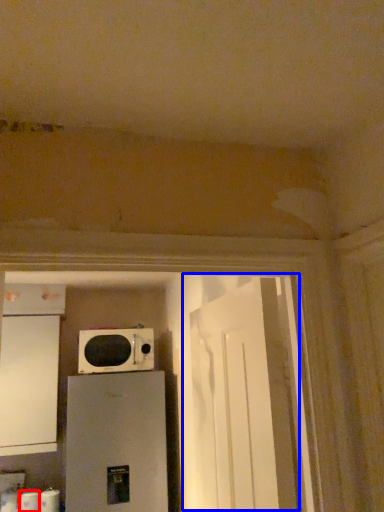
Question: Which object appears farthest to the camera in this image, toilet paper (highlighted by a red box) or door (highlighted by a blue box)?

Choices:
 (A) toilet paper
 (B) door

Answer: (A)